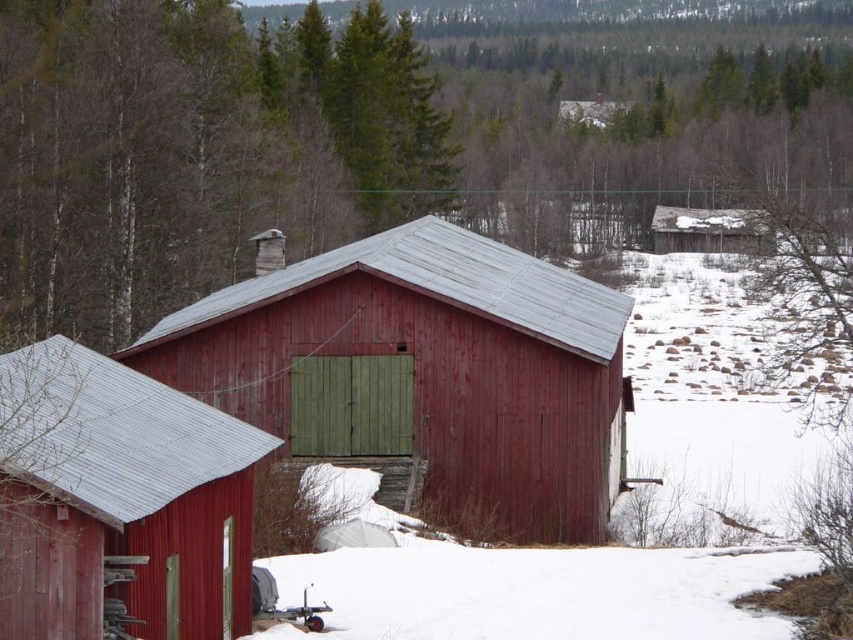
Which is behind, point (236, 493) or point (744, 220)?

Positioned behind is point (744, 220).

Is matte red barn at left to the right of weathered wooden hut at upper right from the viewer's perspective?

Incorrect, matte red barn at left is not on the right side of weathered wooden hut at upper right.

Does point (49, 625) come in front of point (697, 241)?

That is True.

Locate an element on the screen. The height and width of the screenshot is (640, 853). matte red barn at left is located at coordinates coord(119,500).

Which is more to the right, smooth wooden barn at center or matte red barn at left?

smooth wooden barn at center is more to the right.

Does smooth wooden barn at center appear on the left side of matte red barn at left?

Incorrect, smooth wooden barn at center is not on the left side of matte red barn at left.

The image size is (853, 640). What do you see at coordinates (424, 372) in the screenshot? I see `smooth wooden barn at center` at bounding box center [424, 372].

This screenshot has width=853, height=640. What are the coordinates of `smooth wooden barn at center` in the screenshot? It's located at (424, 372).

Does matte red barn at left appear on the left side of white powdery snow at lower center?

Yes, matte red barn at left is to the left of white powdery snow at lower center.

Who is positioned more to the left, matte red barn at left or white powdery snow at lower center?

From the viewer's perspective, matte red barn at left appears more on the left side.

Does point (123, 516) lie in front of point (566, 596)?

Yes, it is.

Locate an element on the screen. The image size is (853, 640). matte red barn at left is located at coordinates (119, 500).